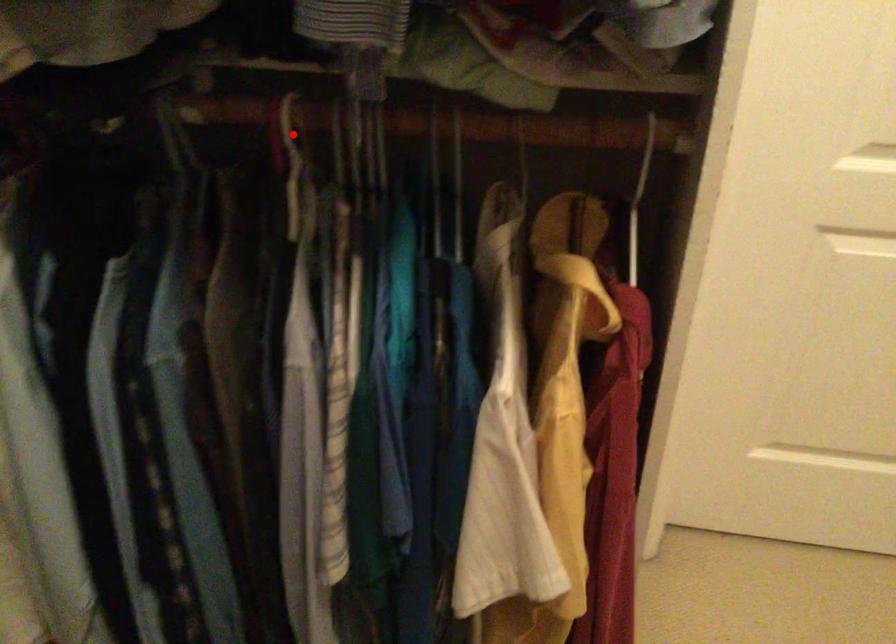
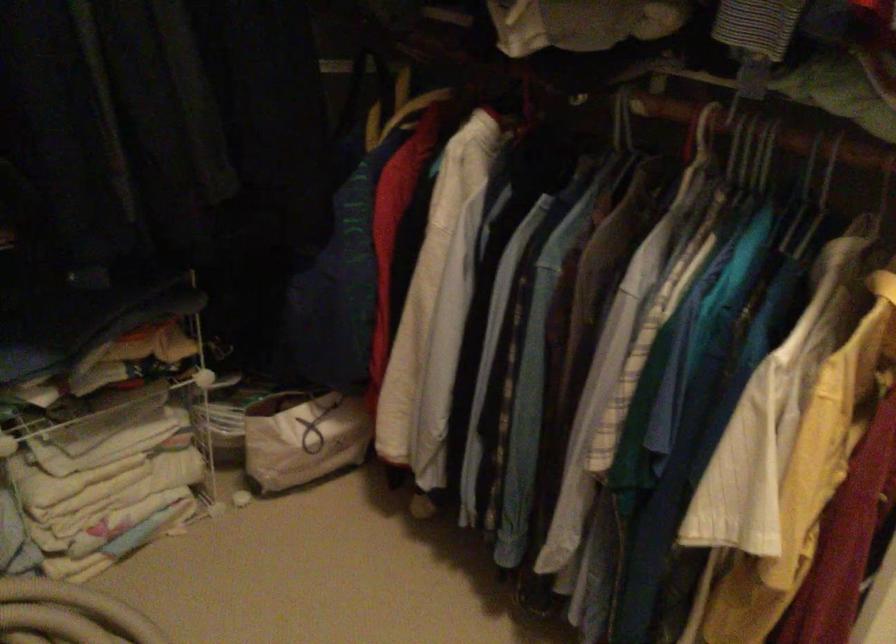
Question: I am providing you with two images of the same scene from different viewpoints. A red point is marked on the first image. Is the red point's position out of view in image 2?

Choices:
 (A) Yes
 (B) No

Answer: (B)